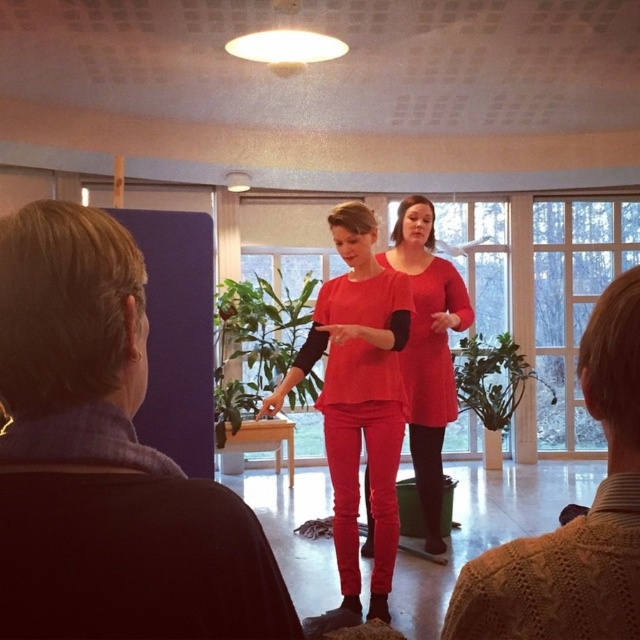
You are an interior designer assessing the layout of the presentation room. You notice the knitted sweater at lower right and the matte red pants at center. Which object occupies more horizontal space in the image?

The matte red pants at center occupies more horizontal space than the knitted sweater at lower right since the knitted sweater at lower right has a lesser width compared to matte red pants at center.

You are an attendee at the presentation and want to take a photo of both the point at (627, 608) and the point at (342, 372). Which point should you focus on first to ensure both are in focus?

You should focus on the point at (342, 372) first because it is farther from the camera than the point at (627, 608). By focusing on the farther point, the closer point will also be within the depth of field, ensuring both are in focus.

You are sitting in the audience and want to see both the presenter at point (120, 445) and the presenter at point (600, 598) clearly. Which presenter is closer to you?

The presenter at point (120, 445) is closer to you because it is in front of the presenter at point (600, 598).